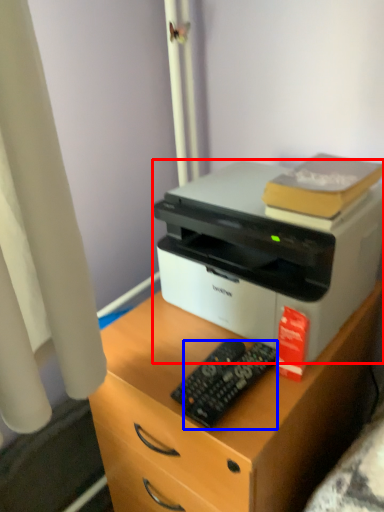
Question: Which point is closer to the camera, printer (highlighted by a red box) or control (highlighted by a blue box)?

Choices:
 (A) printer
 (B) control

Answer: (A)